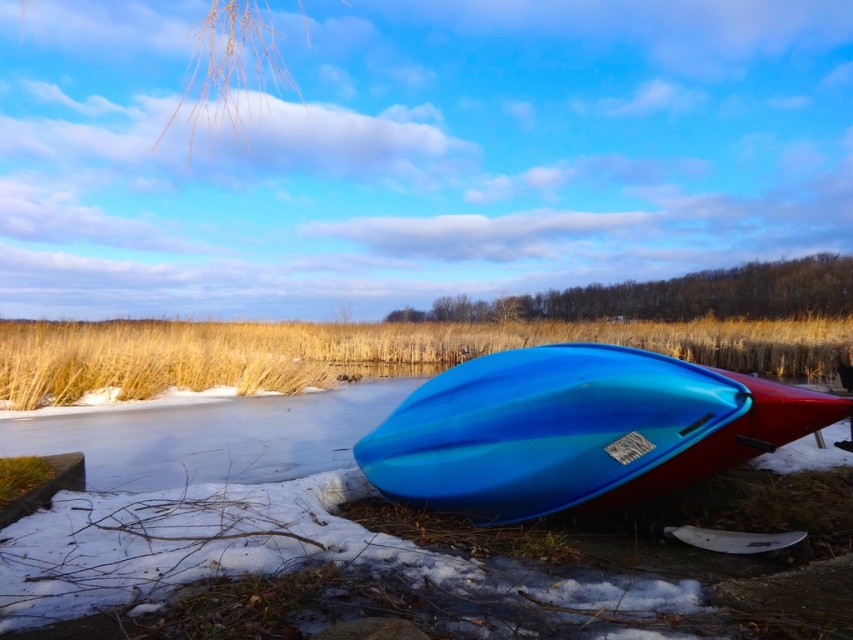
Between point (508, 461) and point (804, 339), which one is positioned behind?

Point (804, 339)

Can you confirm if blue glossy kayak at center is positioned to the left of golden dry grass at lower center?

In fact, blue glossy kayak at center is to the right of golden dry grass at lower center.

Is point (743, 413) positioned in front of point (776, 376)?

That is True.

Locate an element on the screen. Image resolution: width=853 pixels, height=640 pixels. blue glossy kayak at center is located at coordinates (577, 429).